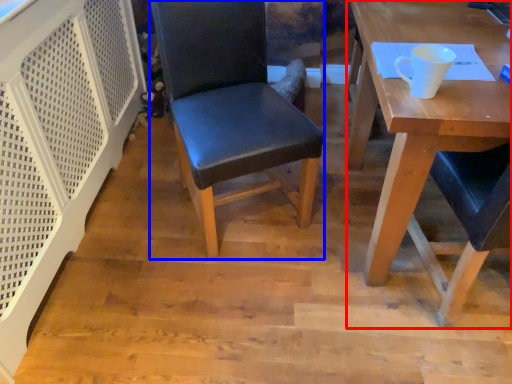
Question: Which object is closer to the camera taking this photo, desk (highlighted by a red box) or chair (highlighted by a blue box)?

Choices:
 (A) desk
 (B) chair

Answer: (A)